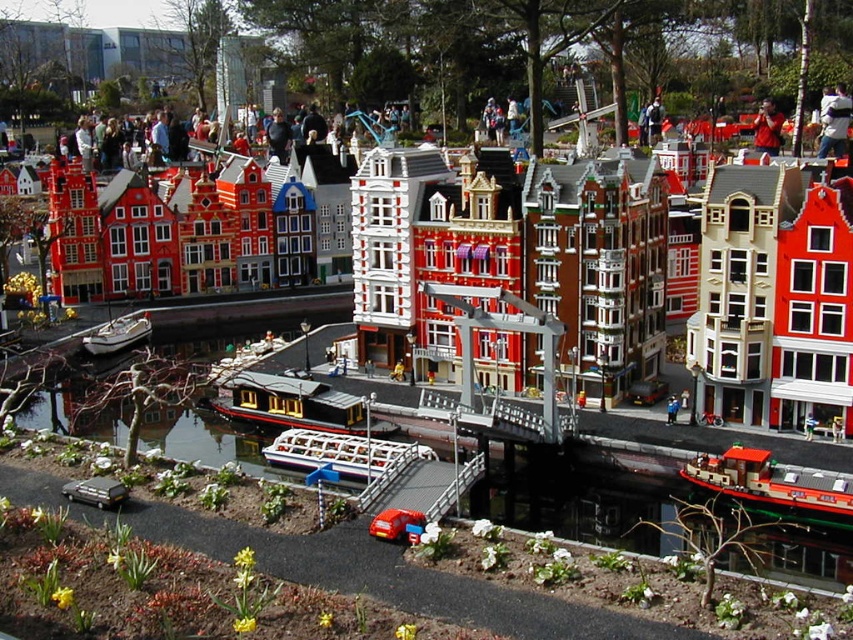
You are a visitor standing on the pedestrian bridge in the canal scene. You notice a white plastic boat at center and a blue fabric person at center. Which object appears bigger in the scene?

The white plastic boat at center has a larger size compared to the blue fabric person at center, so the white plastic boat at center appears bigger.